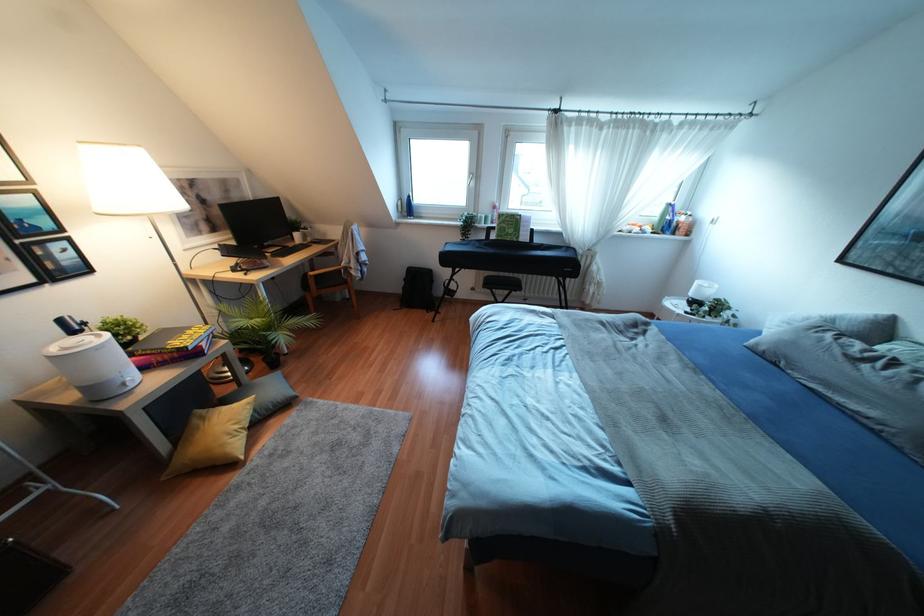
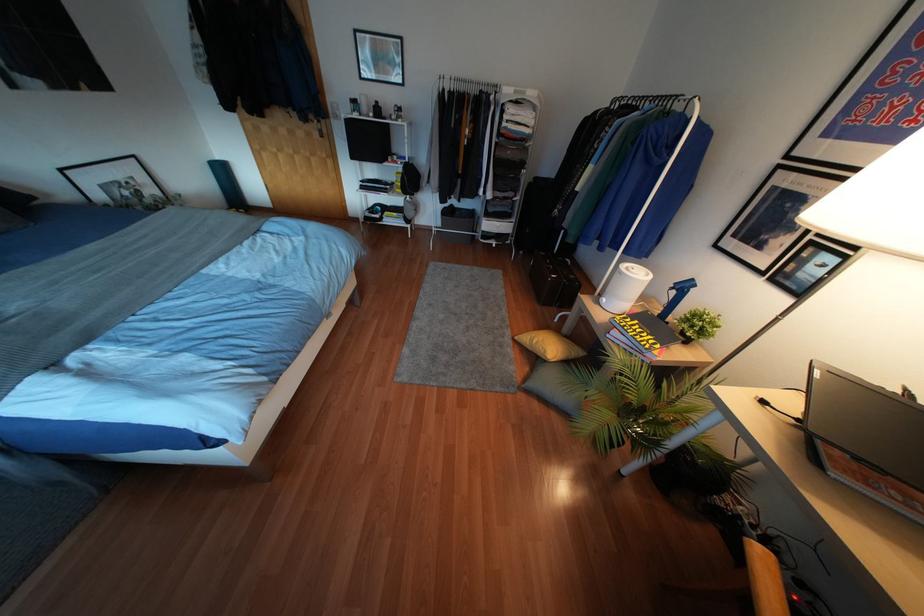
In the second image, find the point that corresponds to (x=236, y=426) in the first image.

(533, 341)